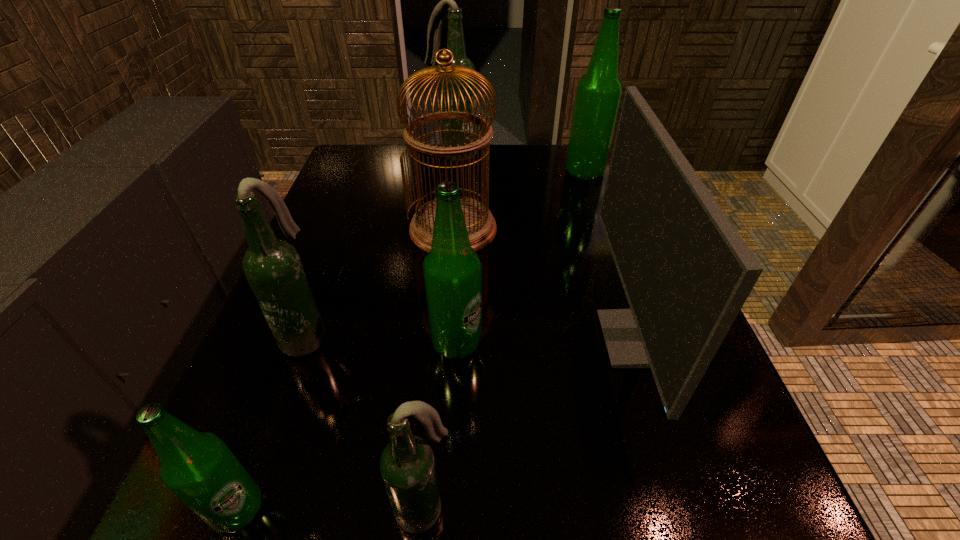
Where is `vacant space at the left edge`? This screenshot has width=960, height=540. vacant space at the left edge is located at coordinates click(x=358, y=190).

Locate an element on the screen. free space at the right edge of the desktop is located at coordinates (586, 206).

Identify the location of vacant space at the far right corner of the desktop. (608, 174).

This screenshot has height=540, width=960. Identify the location of vacant region between the second smallest dark beer bottle and the farthest dark beer bottle. (380, 245).

Find the location of a particular element. This screenshot has height=540, width=960. vacant area between the rightmost beer bottle and the smallest dark beer bottle is located at coordinates (504, 341).

The height and width of the screenshot is (540, 960). I want to click on unoccupied position between the nearest green beer bottle and the leftmost dark beer bottle, so click(272, 422).

Find the location of a particular element. unoccupied area between the biggest green beer bottle and the birdcage is located at coordinates click(x=519, y=201).

This screenshot has width=960, height=540. What are the coordinates of `vacant region between the computer monitor and the nearest dark beer bottle` in the screenshot? It's located at (529, 424).

Find the location of a particular element. The height and width of the screenshot is (540, 960). free spot between the computer monitor and the second green beer bottle from right to left is located at coordinates (545, 341).

Locate an element on the screen. free space between the smallest dark beer bottle and the second smallest dark beer bottle is located at coordinates (365, 421).